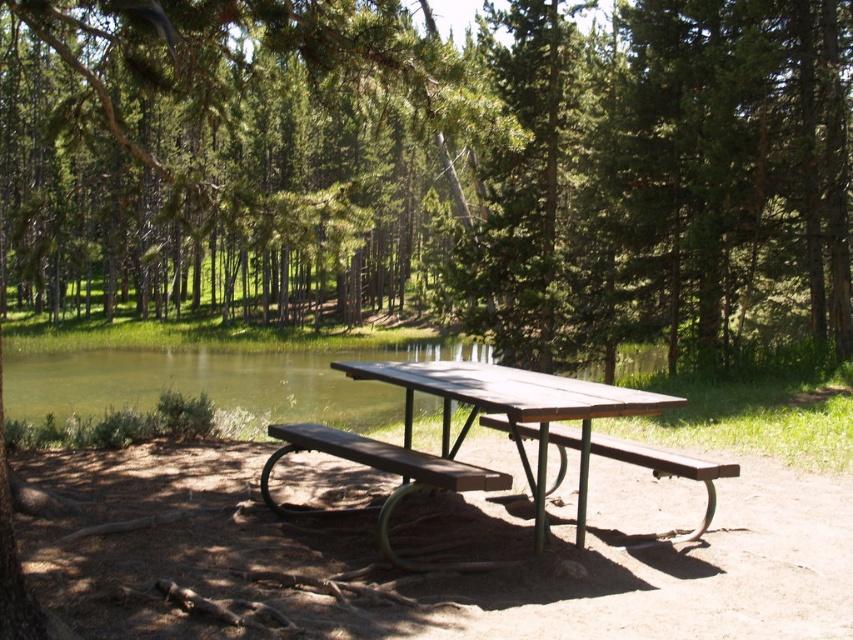
You are planning to set up a small tent for a picnic. The wooden picnic table at center and the wooden bench at center are in the way. Which object should you move to make more space?

The wooden picnic table at center is smaller than the wooden bench at center, so you should move the wooden bench at center to make more space.

You are planning to set up a small tent for a picnic. You have a tent that requires a minimum height clearance of 1.5 meters. Based on the scene, can the wooden picnic table at center and the wooden bench at center accommodate the tent height requirement?

The wooden picnic table at center is shorter than the wooden bench at center. Since the bench is taller, if the tent requires a minimum height clearance of 1.5 meters, you should check the height of the bench. If the bench is at least 1.5 meters tall, the tent can be placed there. However, the picnic table being shorter might not meet the height requirement.

You are standing at the picnic table and want to take a photo of the green textured tree at center. Where should you position yourself to capture the tree in the frame?

You should position yourself facing the green textured tree at center, which is located at point (438, 164), to capture it in the frame.